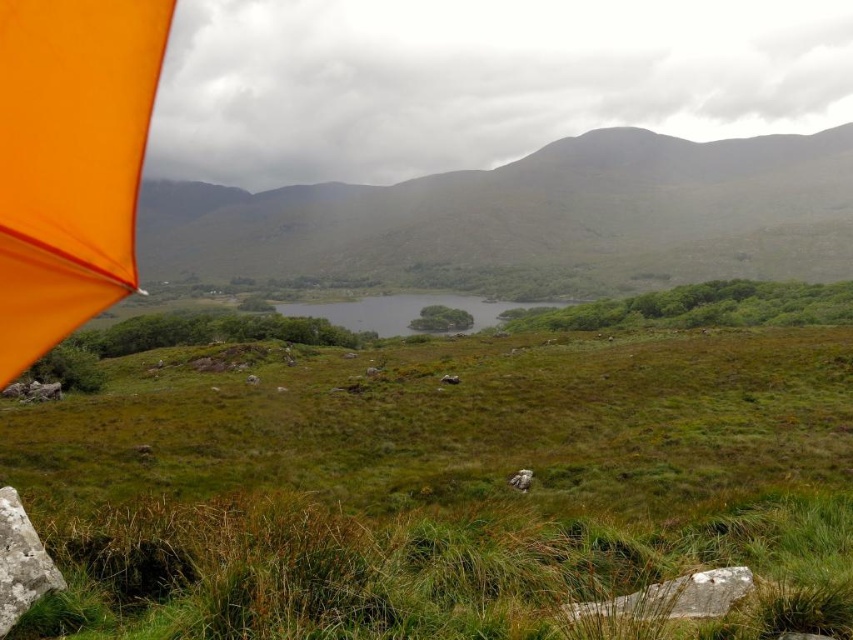
Question: Based on their relative distances, which object is farther from the orange fabric umbrella at upper left?

Choices:
 (A) green grassy hillside at center
 (B) green grassy lake at center
 (C) green grassy field at center

Answer: (A)

Question: Is green grassy hillside at center behind orange fabric umbrella at upper left?

Choices:
 (A) yes
 (B) no

Answer: (A)

Question: Among these objects, which one is farthest from the camera?

Choices:
 (A) green grassy hillside at center
 (B) orange fabric umbrella at upper left
 (C) green grassy lake at center
 (D) green grassy field at center

Answer: (A)

Question: Based on their relative distances, which object is nearer to the green grassy hillside at center?

Choices:
 (A) orange fabric umbrella at upper left
 (B) green grassy lake at center
 (C) green grassy field at center

Answer: (B)

Question: Is green grassy field at center below green grassy hillside at center?

Choices:
 (A) no
 (B) yes

Answer: (B)

Question: Is green grassy field at center above orange fabric umbrella at upper left?

Choices:
 (A) no
 (B) yes

Answer: (A)